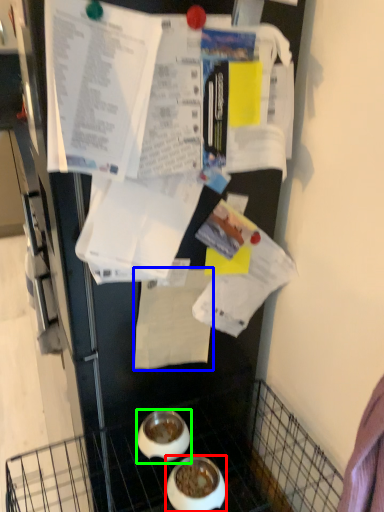
Question: Based on their relative distances, which object is nearer to bowl (highlighted by a red box)? Choose from paper (highlighted by a blue box) and bowl (highlighted by a green box).

Choices:
 (A) paper
 (B) bowl

Answer: (B)